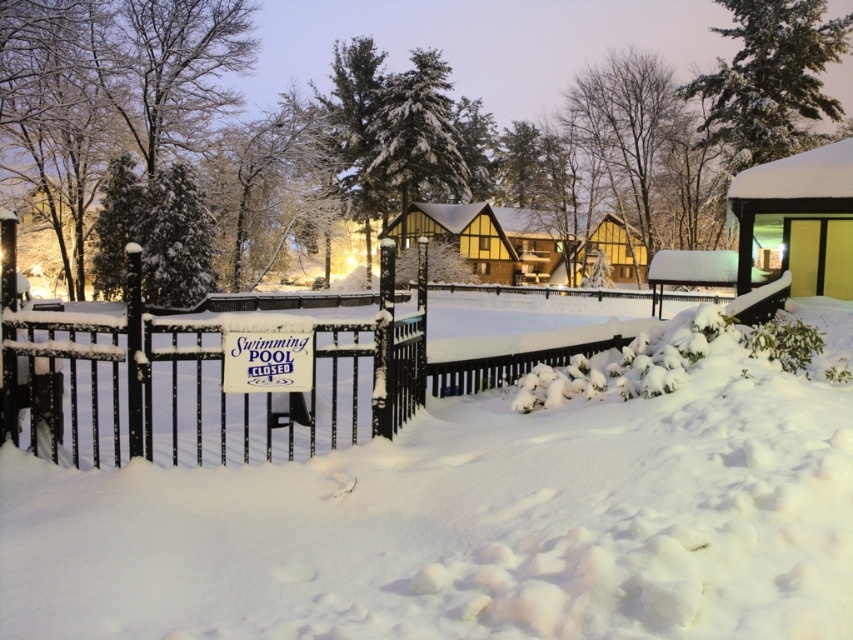
Who is positioned more to the right, black metal fence at center or white plastic sign at center?

black metal fence at center is more to the right.

Does black metal fence at center appear over white plastic sign at center?

Yes, black metal fence at center is above white plastic sign at center.

This screenshot has height=640, width=853. Identify the location of black metal fence at center. (248, 392).